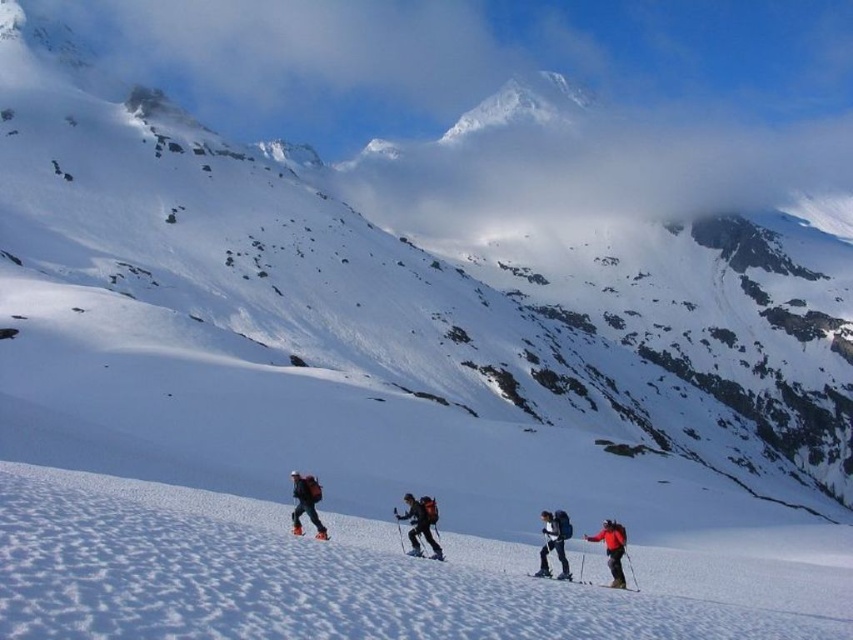
Is matte black backpack at center taller than white matte ski at lower center?

Yes, matte black backpack at center is taller than white matte ski at lower center.

Which is more to the right, matte black backpack at center or white matte ski at lower center?

matte black backpack at center is more to the right.

Identify the location of matte black backpack at center. This screenshot has height=640, width=853. (421, 524).

Is white matte ski at lower center further to the viewer compared to matte black ski at lower right?

Yes, it is behind matte black ski at lower right.

Looking at this image, which is more to the left, white matte ski at lower center or matte black ski at lower right?

From the viewer's perspective, white matte ski at lower center appears more on the left side.

Describe the element at coordinates (321, 536) in the screenshot. I see `white matte ski at lower center` at that location.

The width and height of the screenshot is (853, 640). Find the location of `white matte ski at lower center`. white matte ski at lower center is located at coordinates (321, 536).

Is red backpack at center smaller than matte black ski at lower right?

Actually, red backpack at center might be larger than matte black ski at lower right.

Does red backpack at center lie behind matte black ski at lower right?

That is True.

Where is `red backpack at center`? red backpack at center is located at coordinates (554, 541).